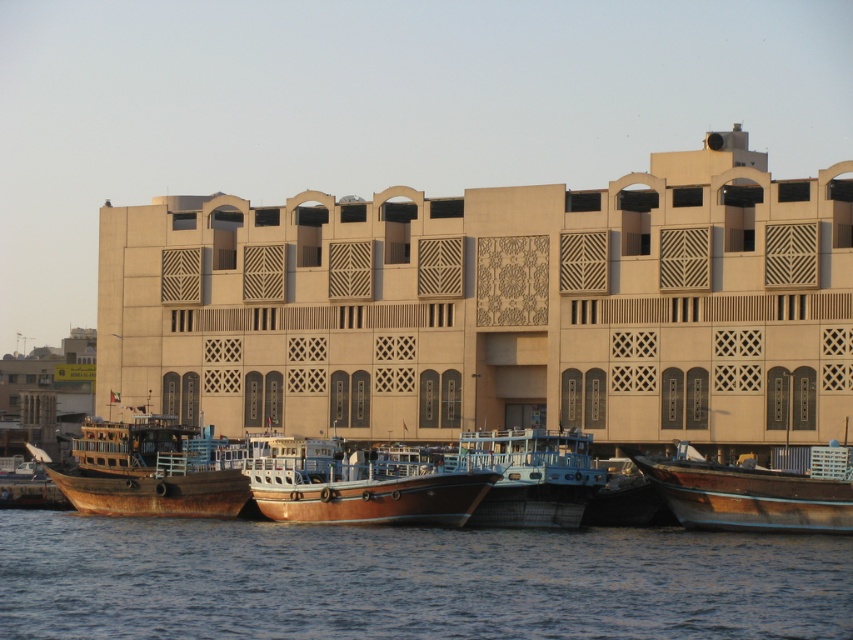
Between point (439, 500) and point (471, 524), which one is positioned behind?

Point (471, 524)

Can you confirm if wooden polished boat at center is thinner than wooden blue boat at center?

In fact, wooden polished boat at center might be wider than wooden blue boat at center.

Locate an element on the screen. The height and width of the screenshot is (640, 853). wooden polished boat at center is located at coordinates (357, 484).

Is rusty wood boat at left taller than wooden boat at lower left?

Yes, rusty wood boat at left is taller than wooden boat at lower left.

Between point (169, 442) and point (0, 496), which one is positioned behind?

The point (0, 496) is behind.

Where is `rusty wood boat at left`? rusty wood boat at left is located at coordinates (148, 472).

Which is more to the left, wooden boat at right or wooden blue boat at center?

Positioned to the left is wooden blue boat at center.

Which of these two, wooden boat at right or wooden blue boat at center, stands shorter?

With less height is wooden boat at right.

Where is `wooden boat at right`? The image size is (853, 640). wooden boat at right is located at coordinates (747, 497).

The width and height of the screenshot is (853, 640). I want to click on wooden boat at right, so click(x=747, y=497).